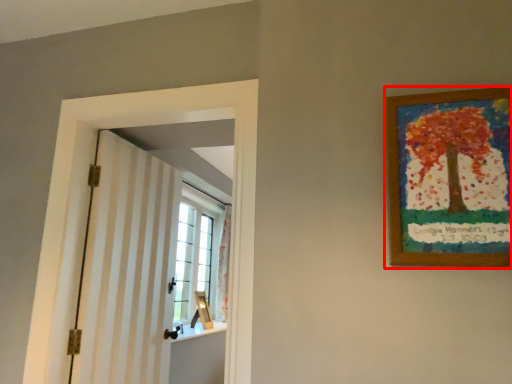
Question: From the image's perspective, what is the correct spatial positioning of picture frame (annotated by the red box) in reference to barn door?

Choices:
 (A) above
 (B) below

Answer: (A)